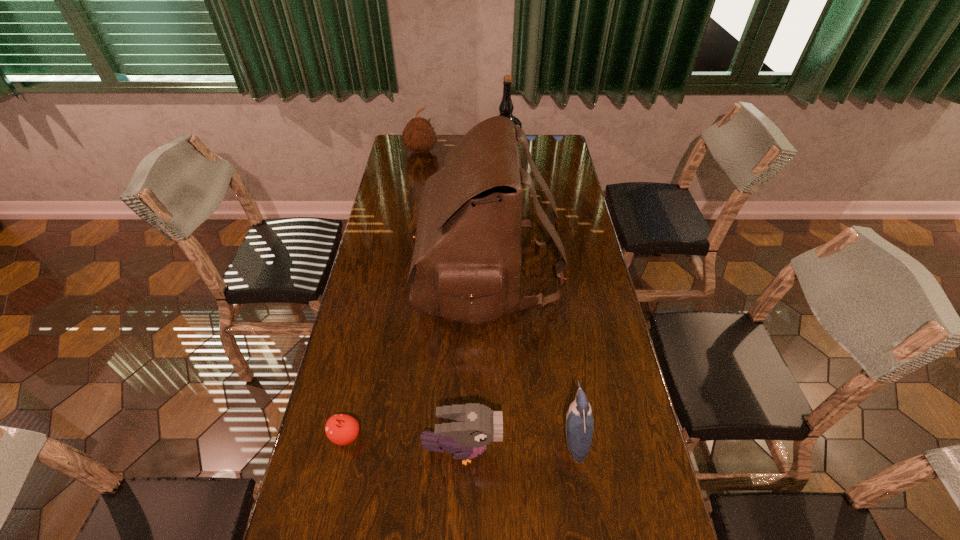
At what (x,y) coordinates should I click in order to perform the action: click on apple at the left edge. Please return your answer as a coordinate pair (x, y). Looking at the image, I should click on (341, 429).

The width and height of the screenshot is (960, 540). What are the coordinates of `satchel present at the right edge` in the screenshot? It's located at (467, 257).

Find the location of a particular element. bird that is at the right edge is located at coordinates (579, 421).

Identify the location of object located at the far left corner. This screenshot has height=540, width=960. point(419,136).

Locate an element on the screen. Image resolution: width=960 pixels, height=540 pixels. vacant point at the left edge is located at coordinates (396, 192).

Identify the location of vacant space at the right edge of the desktop. (579, 324).

The image size is (960, 540). What are the coordinates of `vacant region at the far left corner of the desktop` in the screenshot? It's located at (400, 150).

Find the location of a particular element. This screenshot has width=960, height=540. blank space at the far right corner is located at coordinates (538, 156).

Identify the location of vacant area that lies between the shortest object and the coconut. The width and height of the screenshot is (960, 540). (383, 294).

Locate an element on the screen. This screenshot has width=960, height=540. free point between the third farthest object and the right bird is located at coordinates (530, 355).